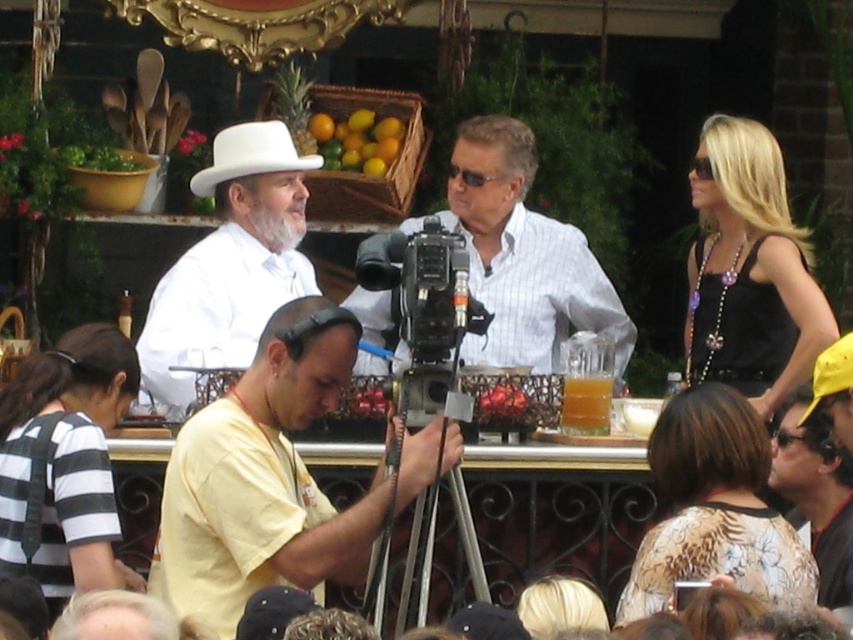
Is black plastic video camera at center to the right of silver metallic tripod at center from the viewer's perspective?

Incorrect, black plastic video camera at center is not on the right side of silver metallic tripod at center.

Is point (422, 237) behind point (434, 500)?

Yes.

Identify the location of black plastic video camera at center. Image resolution: width=853 pixels, height=640 pixels. (422, 310).

At what (x,y) coordinates should I click in order to perform the action: click on white matte hat at upper left. Please return your answer as a coordinate pair (x, y). The height and width of the screenshot is (640, 853). Looking at the image, I should click on (229, 264).

Is white matte hat at upper left to the right of black plastic video camera at center from the viewer's perspective?

No, white matte hat at upper left is not to the right of black plastic video camera at center.

Which is in front, point (236, 256) or point (448, 275)?

Positioned in front is point (448, 275).

Where is `white matte hat at upper left`? This screenshot has height=640, width=853. white matte hat at upper left is located at coordinates (229, 264).

The width and height of the screenshot is (853, 640). Find the location of `silver metallic tripod at center`. silver metallic tripod at center is located at coordinates (418, 557).

Can you confirm if silver metallic tripod at center is smaller than translucent glass cup at center?

No.

In order to click on silver metallic tripod at center in this screenshot , I will do `click(418, 557)`.

Locate an element on the screen. silver metallic tripod at center is located at coordinates (418, 557).